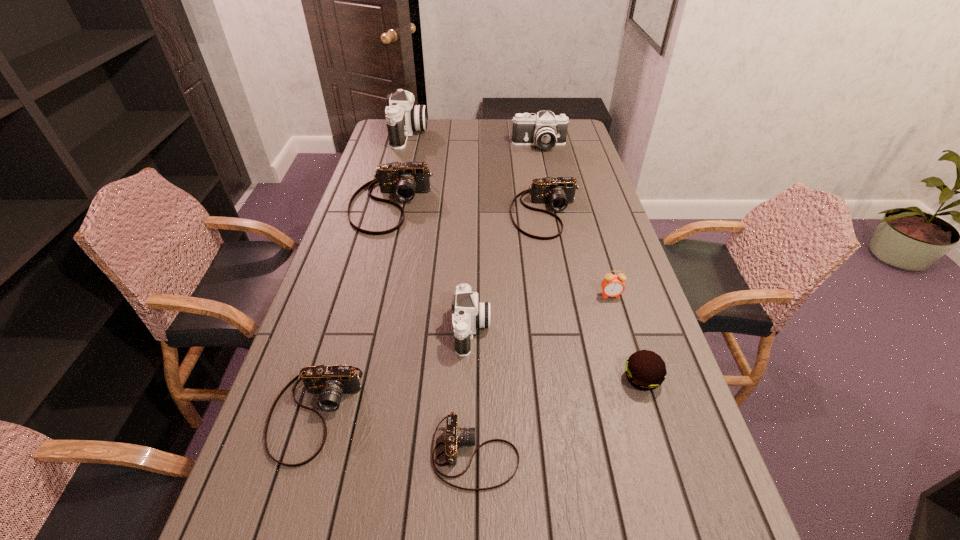
Locate an element on the screen. This screenshot has height=540, width=960. the third shortest camera is located at coordinates (558, 192).

Find the location of a particular element. Image resolution: width=960 pixels, height=540 pixels. patty is located at coordinates (645, 370).

The width and height of the screenshot is (960, 540). I want to click on the sixth tallest camera, so click(x=331, y=382).

This screenshot has height=540, width=960. In order to click on the shortest camera in this screenshot , I will do `click(454, 436)`.

Where is `the shortest object`? The height and width of the screenshot is (540, 960). the shortest object is located at coordinates (454, 436).

Identify the location of vacant space situated on the right of the biggest black camera. The height and width of the screenshot is (540, 960). (451, 134).

The width and height of the screenshot is (960, 540). What are the coordinates of `free space located on the front of the second tallest object` in the screenshot? It's located at (544, 172).

Locate an element on the screen. free space located 0.100m on the right of the fifth farthest camera is located at coordinates (528, 330).

Identify the location of vacant space located 0.050m on the front-facing side of the biggest brown camera. (381, 245).

Locate an element on the screen. The width and height of the screenshot is (960, 540). vacant space situated 0.400m on the face of the fifth farthest object is located at coordinates (652, 433).